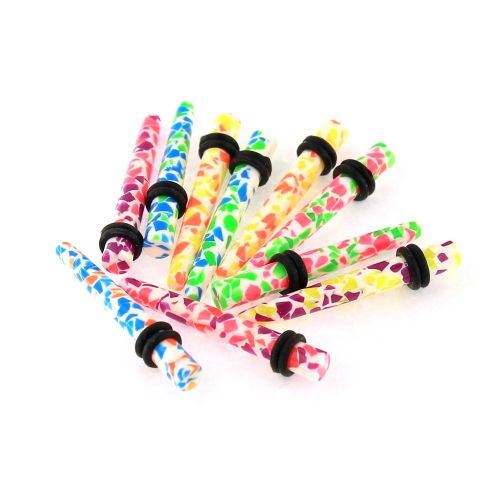
In order to click on empty sapce left of plug in this screenshot , I will do `click(79, 177)`.